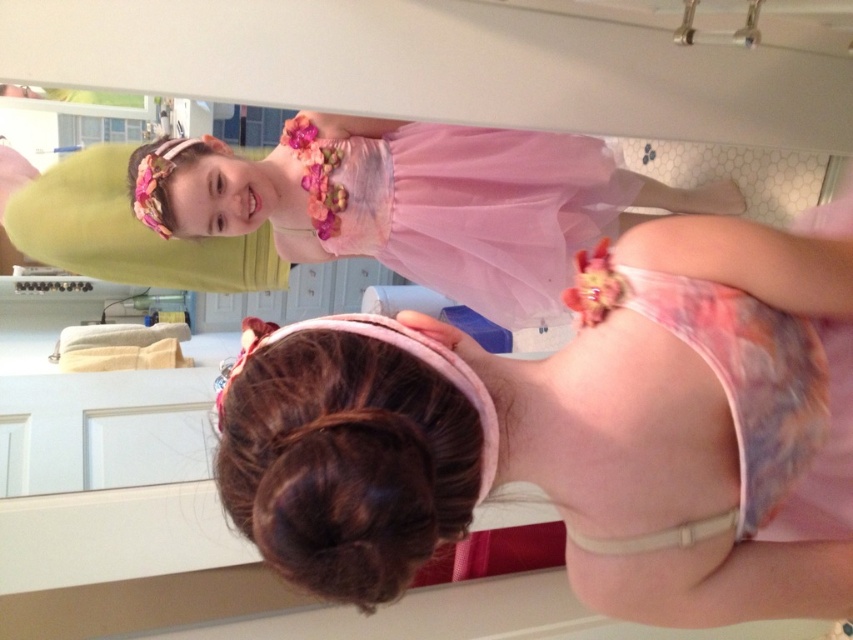
Question: Among these objects, which one is nearest to the camera?

Choices:
 (A) pink sheer ballet skirt at upper center
 (B) brownhair at center
 (C) pink tulle dress at upper center
 (D) matte pink dress at upper center

Answer: (B)

Question: Can you confirm if pink tulle dress at upper center is positioned below brownhair at center?

Choices:
 (A) no
 (B) yes

Answer: (B)

Question: Is matte pink dress at upper center behind pink sheer ballet skirt at upper center?

Choices:
 (A) yes
 (B) no

Answer: (B)

Question: Which point is farther to the camera?

Choices:
 (A) (378, 227)
 (B) (337, 440)
 (C) (432, 385)

Answer: (A)

Question: Considering the real-world distances, which object is farthest from the brownhair at center?

Choices:
 (A) pink sheer ballet skirt at upper center
 (B) matte pink dress at upper center

Answer: (A)

Question: Is matte pink dress at upper center closer to the viewer compared to brownhair at center?

Choices:
 (A) yes
 (B) no

Answer: (B)